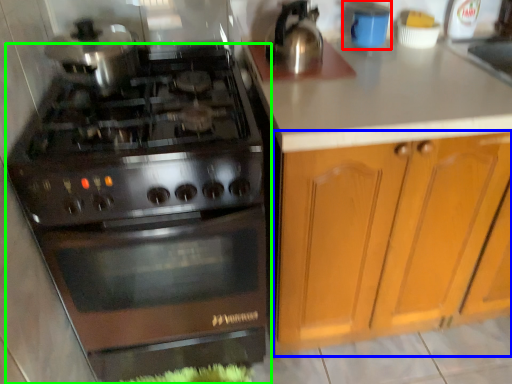
Question: Based on their relative distances, which object is farther from appliance (highlighted by a red box)? Choose from cabinetry (highlighted by a blue box) and gas stove (highlighted by a green box).

Choices:
 (A) cabinetry
 (B) gas stove

Answer: (B)